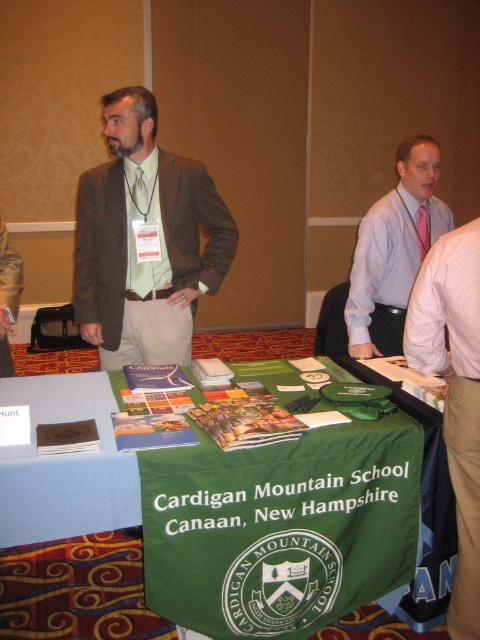
You are a guest at the event and want to approach the pink satin shirt at center. Which direction should you move relative to the green fabric table at center?

The green fabric table at center is positioned on the left side of the pink satin shirt at center, so to approach the pink satin shirt at center, you should move to the right from the green fabric table at center.

You are attending a conference and see two men at the table with promotional materials. One is wearing a pink striped shirt at right and the other a pink satin shirt at center. From your perspective facing the table, which man is positioned closer to your left side?

The pink striped shirt at right is to the left of the pink satin shirt at center, so the man in the pink striped shirt at right is positioned closer to your left side.